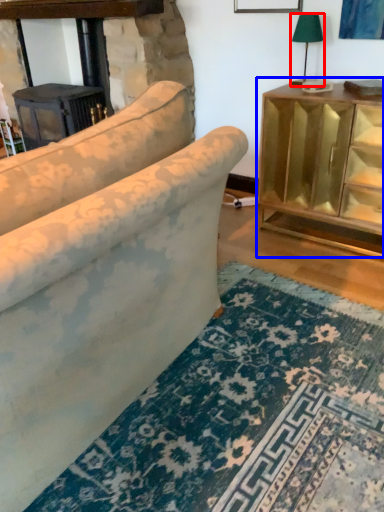
Question: Which object appears farthest to the camera in this image, table lamp (highlighted by a red box) or table (highlighted by a blue box)?

Choices:
 (A) table lamp
 (B) table

Answer: (A)